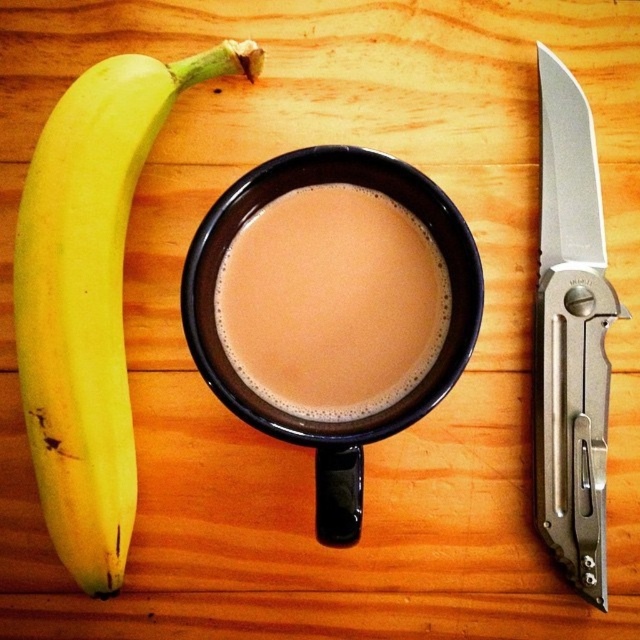
You are setting up a breakfast tray on the wooden surface and need to place the brown matte mug at center and the silver metallic pocketknife at right. The tray requires the knife to be exactly 30 centimeters away from the mug. Based on the image, will the current arrangement meet the requirement?

The brown matte mug at center is 30.02 centimeters from the silver metallic pocketknife at right, which is very close to the required 30 centimeters. The slight difference of 0.02 centimeters is negligible, so the current arrangement meets the requirement.

From the picture: You are an artist sketching the scene on the wooden surface. You need to place the yellow matte banana at left in your drawing. Where should you position it relative to the center of the wooden surface?

The yellow matte banana at left is located at point 0.466 on the horizontal axis and 0.142 on the vertical axis relative to the center of the wooden surface.

You have a yellow matte banana at left and a matte ceramic mug at center on a wooden table. If you want to place a small spoon between them, will the space between the two objects be wide enough for the spoon?

The yellow matte banana at left has a lesser width compared to matte ceramic mug at center, so the space between them is sufficient to place a small spoon.